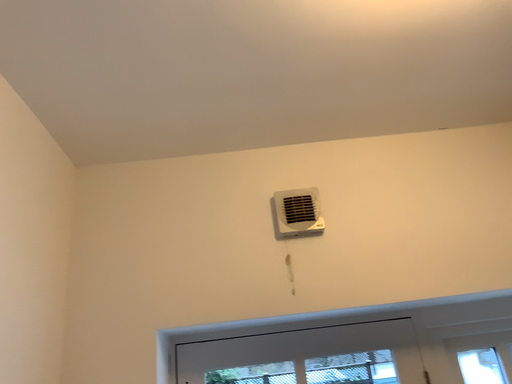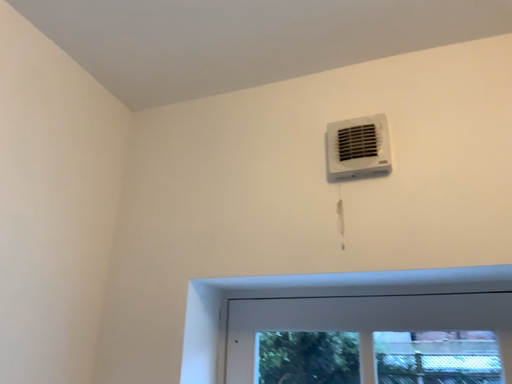
Question: How did the camera likely rotate when shooting the video?

Choices:
 (A) rotated left
 (B) rotated right

Answer: (A)